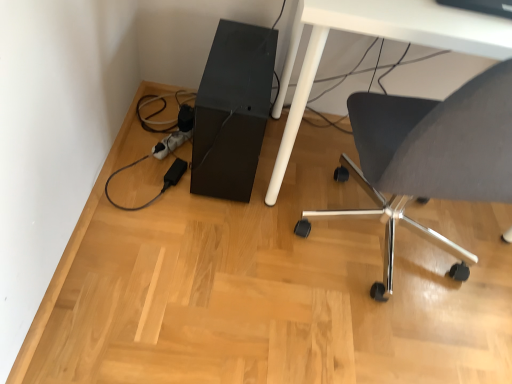
Question: Can you confirm if matte gray chair at lower right is smaller than white glossy table at lower right?

Choices:
 (A) no
 (B) yes

Answer: (B)

Question: Is matte gray chair at lower right at the left side of white glossy table at lower right?

Choices:
 (A) yes
 (B) no

Answer: (A)

Question: Considering the relative sizes of matte gray chair at lower right and white glossy table at lower right in the image provided, is matte gray chair at lower right thinner than white glossy table at lower right?

Choices:
 (A) no
 (B) yes

Answer: (B)

Question: Is matte gray chair at lower right far away from white glossy table at lower right?

Choices:
 (A) no
 (B) yes

Answer: (A)

Question: Does matte gray chair at lower right have a greater height compared to white glossy table at lower right?

Choices:
 (A) no
 (B) yes

Answer: (B)

Question: Is matte gray chair at lower right located outside white glossy table at lower right?

Choices:
 (A) no
 (B) yes

Answer: (A)

Question: Does black matte computer tower at lower center lie in front of white glossy table at lower right?

Choices:
 (A) no
 (B) yes

Answer: (A)

Question: Is black matte computer tower at lower center touching white glossy table at lower right?

Choices:
 (A) yes
 (B) no

Answer: (B)

Question: Is the position of black matte computer tower at lower center more distant than that of white glossy table at lower right?

Choices:
 (A) no
 (B) yes

Answer: (B)

Question: Does black matte computer tower at lower center have a smaller size compared to white glossy table at lower right?

Choices:
 (A) no
 (B) yes

Answer: (B)

Question: Can you confirm if black matte computer tower at lower center is positioned to the right of white glossy table at lower right?

Choices:
 (A) yes
 (B) no

Answer: (B)

Question: Is black matte computer tower at lower center oriented away from white glossy table at lower right?

Choices:
 (A) yes
 (B) no

Answer: (B)

Question: Is white glossy table at lower right further to the viewer compared to matte gray chair at lower right?

Choices:
 (A) no
 (B) yes

Answer: (B)